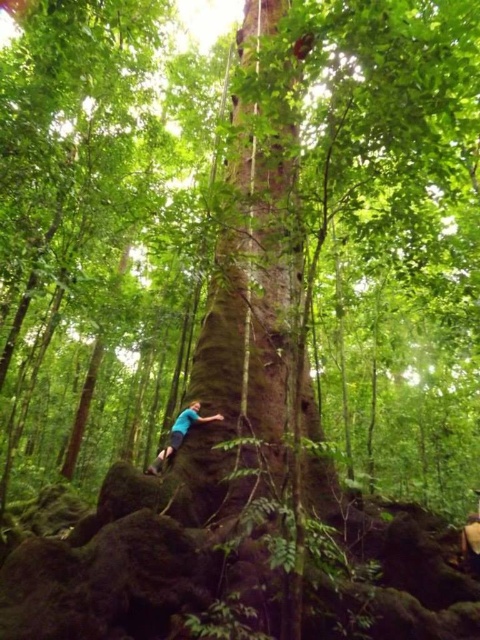
Question: Which of the following is the closest to the observer?

Choices:
 (A) blue fabric shirt at lower center
 (B) smooth brown tree trunk at center

Answer: (B)

Question: Does smooth brown tree trunk at center have a smaller size compared to blue fabric shirt at lower center?

Choices:
 (A) yes
 (B) no

Answer: (A)

Question: Does smooth brown tree trunk at center have a smaller size compared to blue fabric shirt at lower center?

Choices:
 (A) yes
 (B) no

Answer: (A)

Question: From the image, what is the correct spatial relationship of smooth brown tree trunk at center in relation to blue fabric shirt at lower center?

Choices:
 (A) above
 (B) below

Answer: (A)